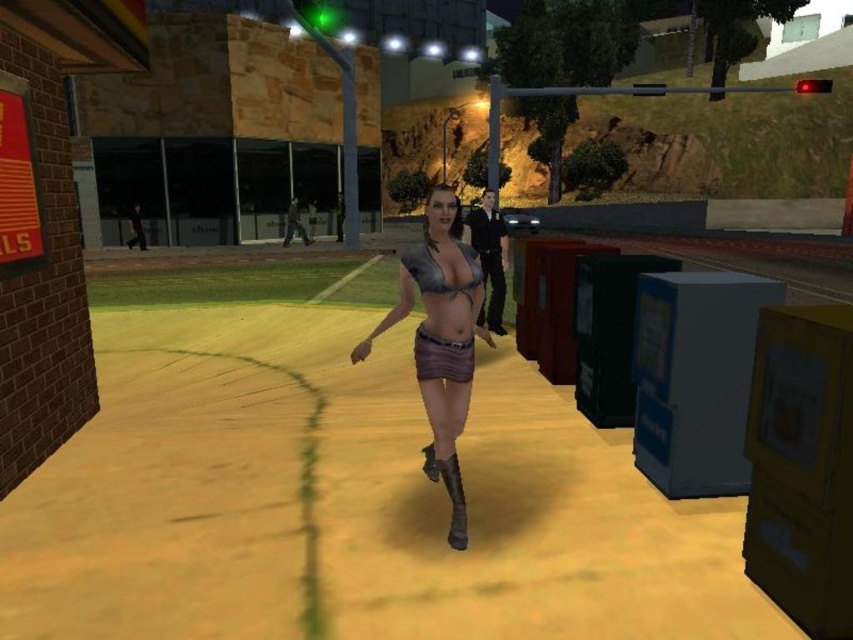
In the video game scene, there are two items worn by the female character at the center of the image. The shiny metallic bra at center and the brown fabric skirt at center. Which one is closer to the viewer?

The shiny metallic bra at center is positioned over the brown fabric skirt at center, so it is closer to the viewer.